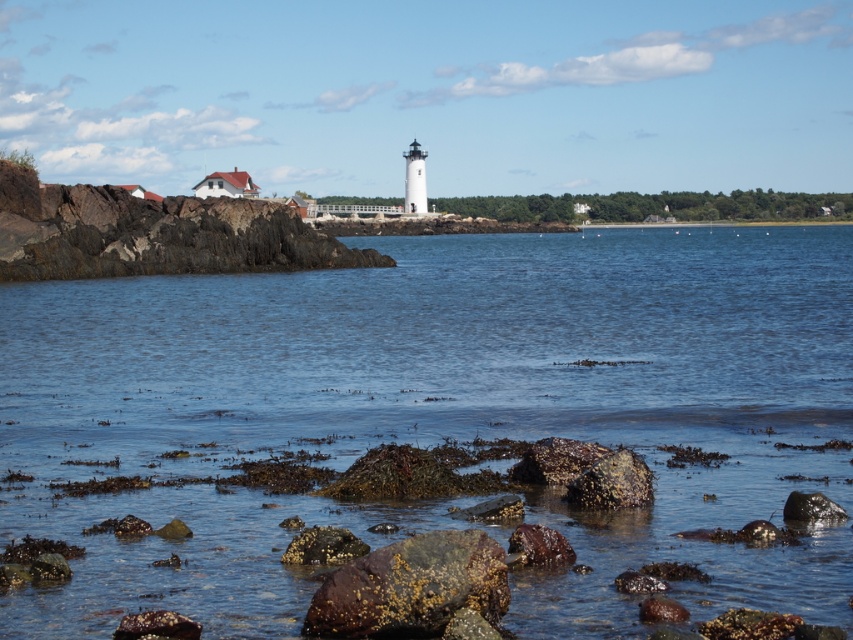
Question: Does clear water at center come behind rusty stone rocks at left?

Choices:
 (A) no
 (B) yes

Answer: (A)

Question: Which is farther from the clear water at center?

Choices:
 (A) speckled rock at center
 (B) smooth gray rock at lower right
 (C) rusty stone rocks at left

Answer: (B)

Question: Which is farther from the speckled rock at center?

Choices:
 (A) rusty stone rocks at left
 (B) rusty metallic rock at center
 (C) clear water at center

Answer: (A)

Question: Is rusty stone rocks at left above speckled rock at center?

Choices:
 (A) no
 (B) yes

Answer: (B)

Question: Which of the following is the closest to the observer?

Choices:
 (A) rusty stone rocks at left
 (B) speckled rock at center
 (C) smooth gray rock at lower right

Answer: (C)

Question: Does clear water at center appear under rusty stone rocks at left?

Choices:
 (A) no
 (B) yes

Answer: (B)